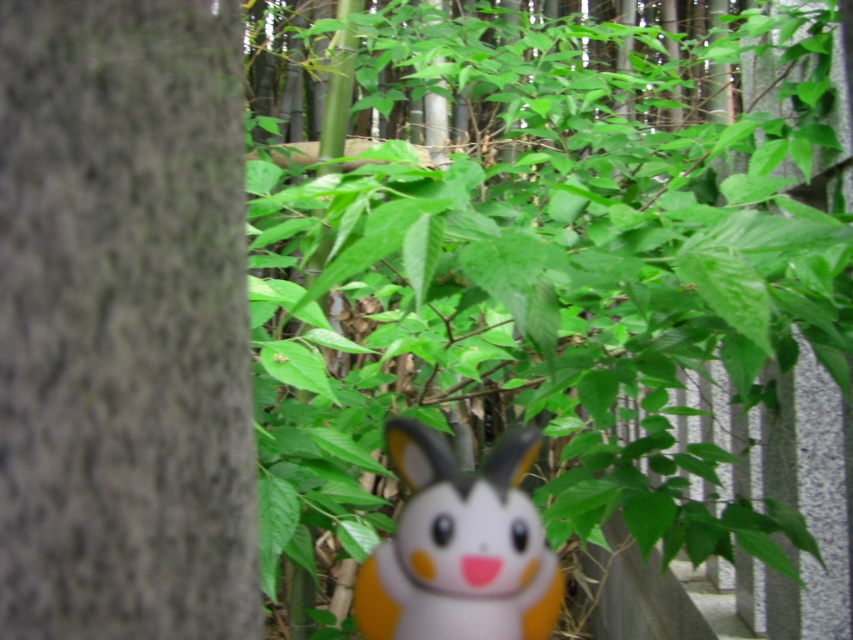
From the picture: Is green leafy plant at center taller than orange matte plush toy at center?

Yes, green leafy plant at center is taller than orange matte plush toy at center.

What do you see at coordinates (548, 253) in the screenshot?
I see `green leafy plant at center` at bounding box center [548, 253].

Is point (584, 186) closer to viewer compared to point (550, 588)?

Yes, it is.

This screenshot has width=853, height=640. Identify the location of green leafy plant at center. (548, 253).

Can you confirm if green leafy plant at center is smaller than gray rough bark at center?

No.

Is point (669, 477) farther from camera compared to point (128, 572)?

Yes, point (669, 477) is farther from viewer.

Find the location of `green leafy plant at center`. green leafy plant at center is located at coordinates (548, 253).

Is the position of gray rough bark at center less distant than that of orange matte plush toy at center?

That is True.

This screenshot has height=640, width=853. What do you see at coordinates (123, 323) in the screenshot? I see `gray rough bark at center` at bounding box center [123, 323].

The width and height of the screenshot is (853, 640). What are the coordinates of `gray rough bark at center` in the screenshot? It's located at (123, 323).